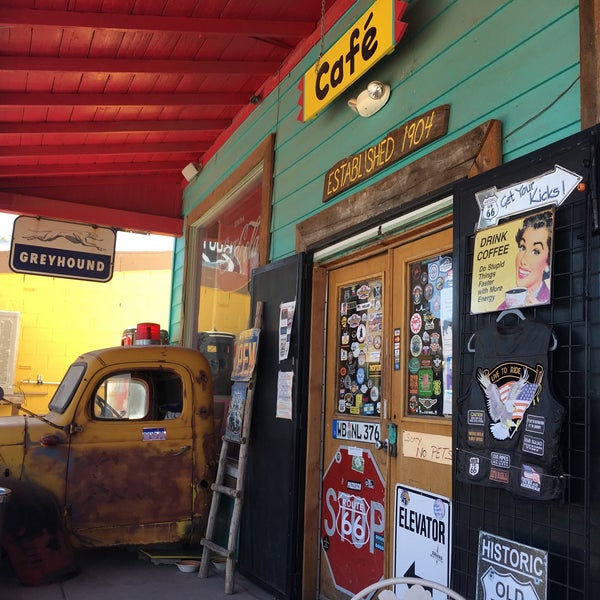
Where is `knob`? The image size is (600, 600). knob is located at coordinates (383, 445).